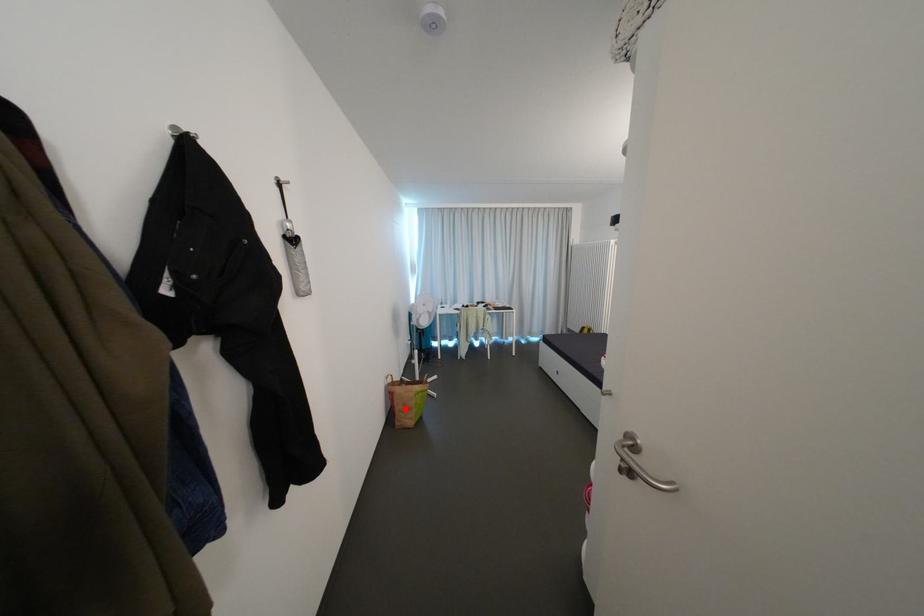
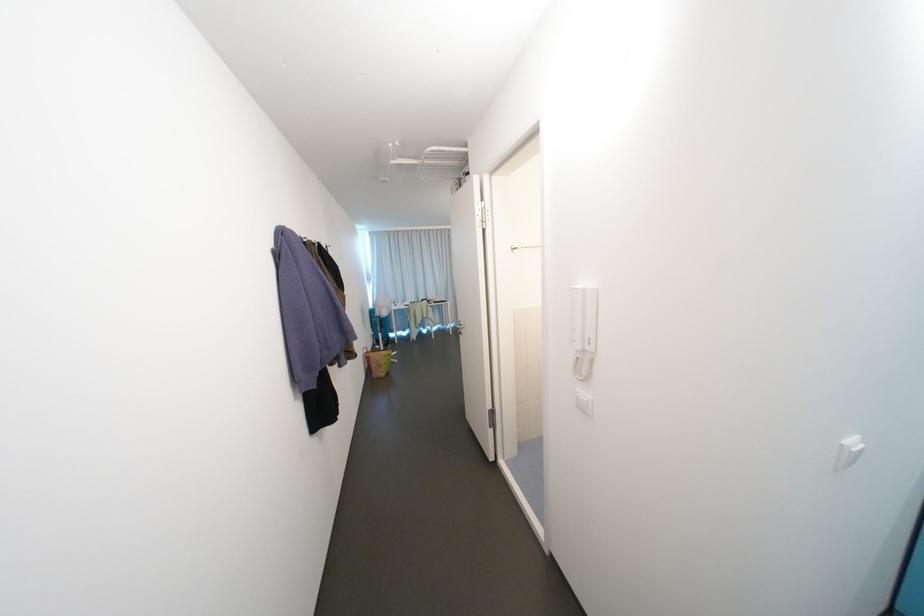
Question: I am providing you with two images of the same scene from different viewpoints. In image1, a red point is highlighted. Considering the same 3D point in image2, which of the following is correct?

Choices:
 (A) It is closer
 (B) It is farther

Answer: (A)